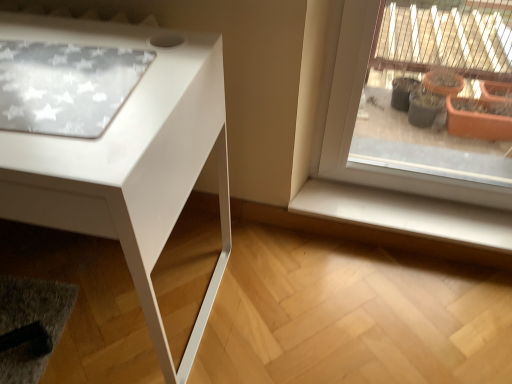
Locate an element on the screen. The image size is (512, 384). vacant region to the right of white glossy table at left is located at coordinates (288, 296).